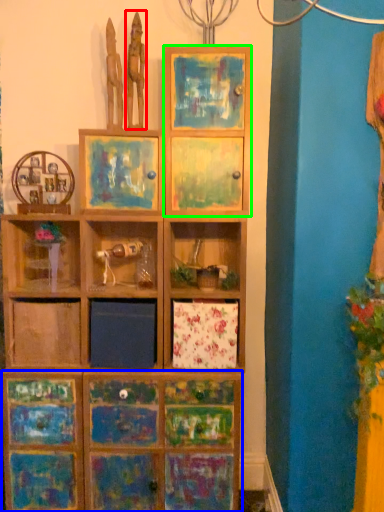
Question: Based on their relative distances, which object is nearer to sculpture (highlighted by a red box)? Choose from cabinetry (highlighted by a blue box) and cabinet (highlighted by a green box).

Choices:
 (A) cabinetry
 (B) cabinet

Answer: (B)